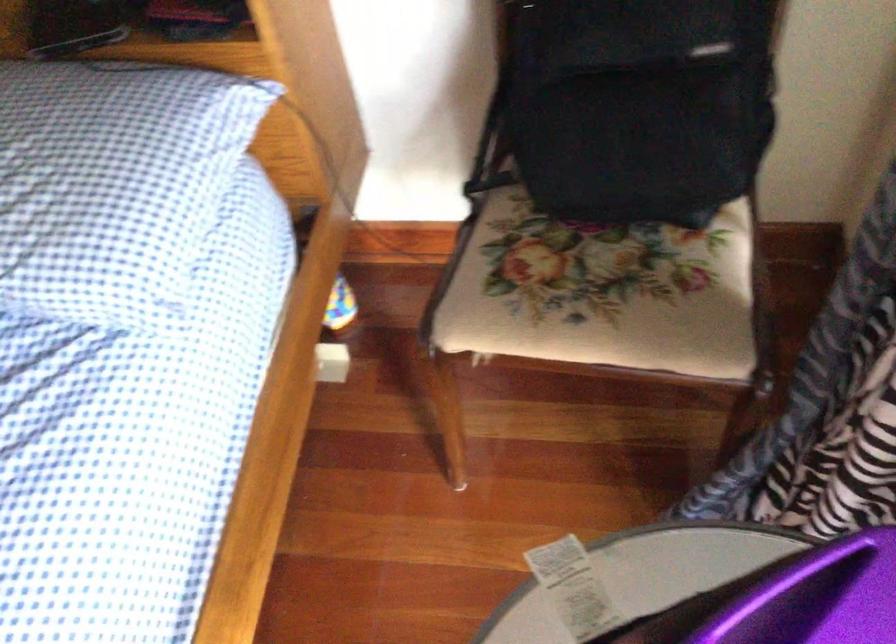
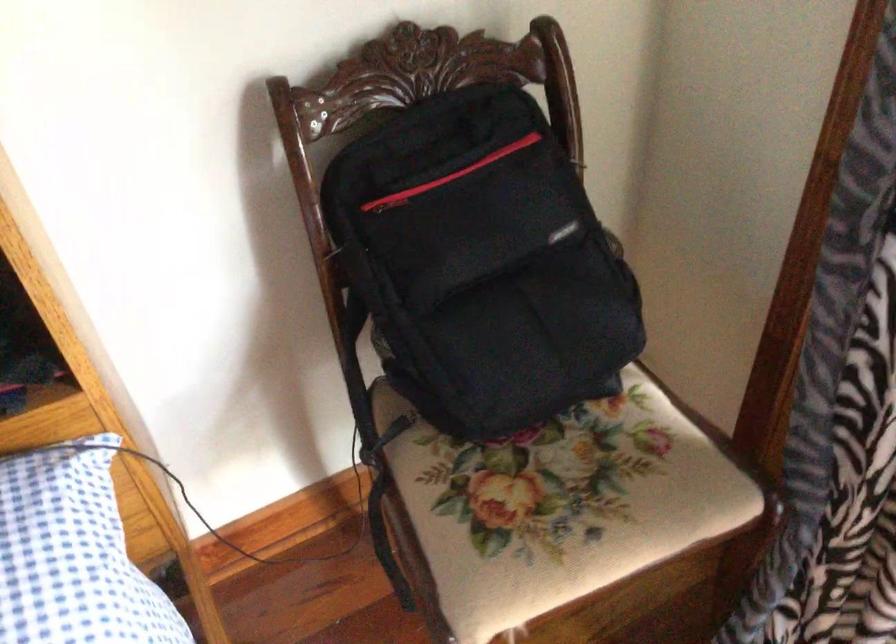
Where in the second image is the point corresponding to (x=566, y=287) from the first image?

(556, 506)